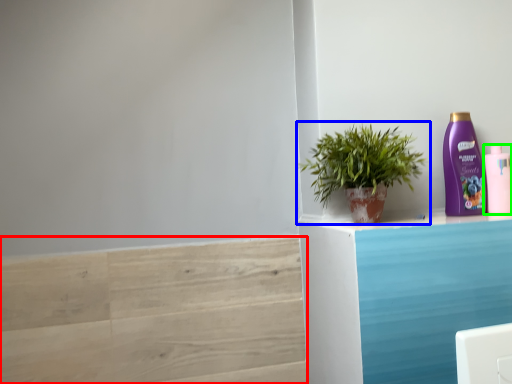
Question: Based on their relative distances, which object is nearer to stair (highlighted by a red box)? Choose from houseplant (highlighted by a blue box) and bottle (highlighted by a green box).

Choices:
 (A) houseplant
 (B) bottle

Answer: (A)